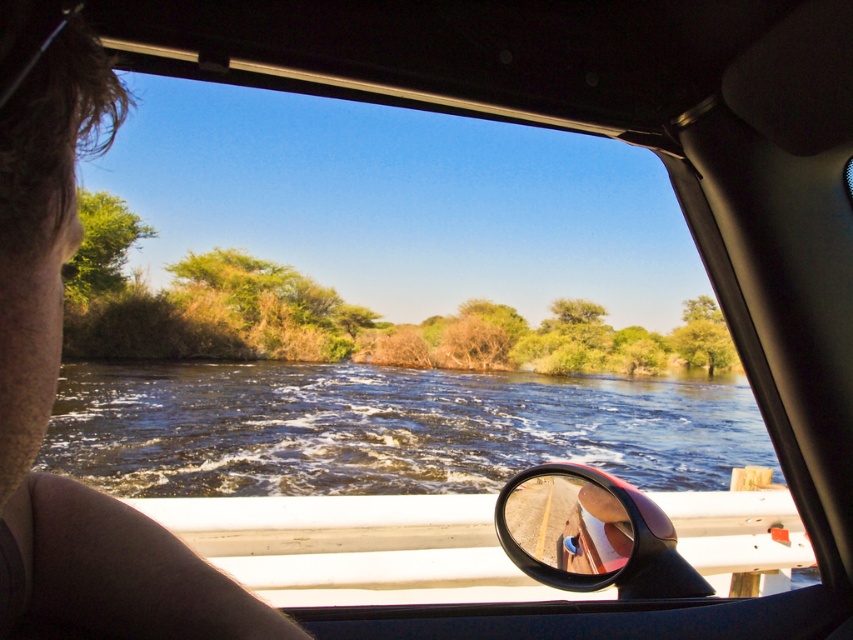
You are a passenger in the open safari car and want to point out two points on the river to the driver. The first point is at coordinates point (x=735, y=442) and the second is at point (x=560, y=529). Which of these two points is closer to you?

Point (x=735, y=442) is further to the viewer than point (x=560, y=529), so the point closer to you is point (x=560, y=529).